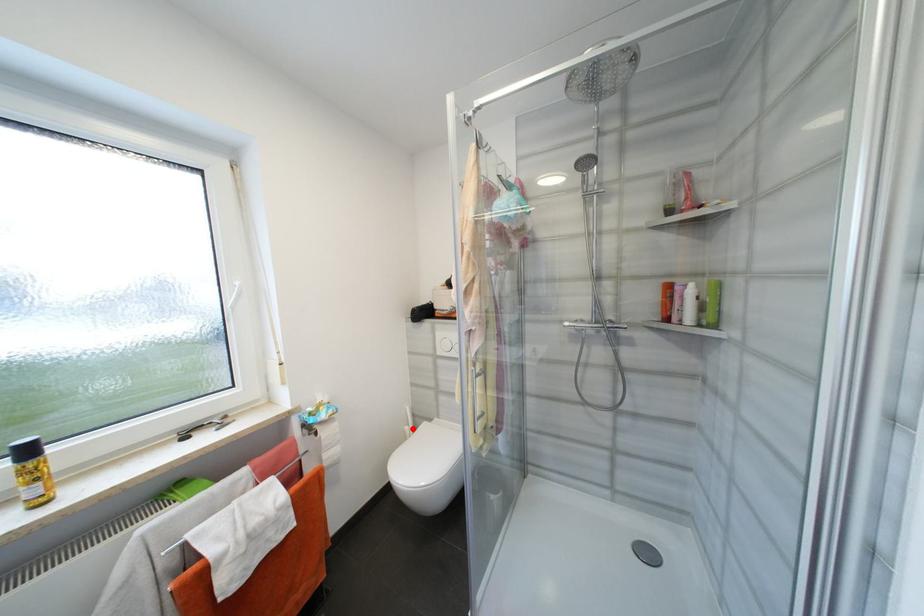
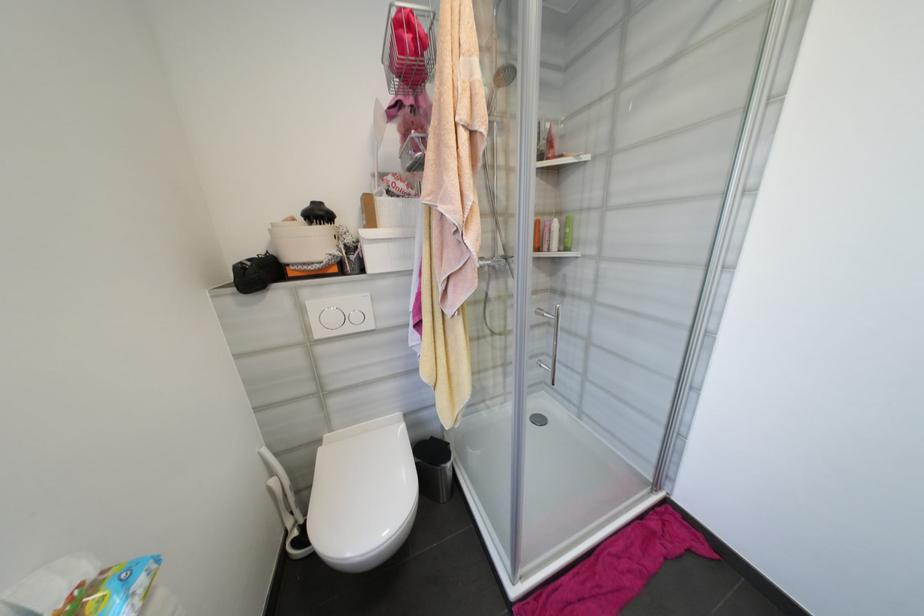
In the second image, find the point that corresponds to the highlighted location in the first image.

(277, 482)